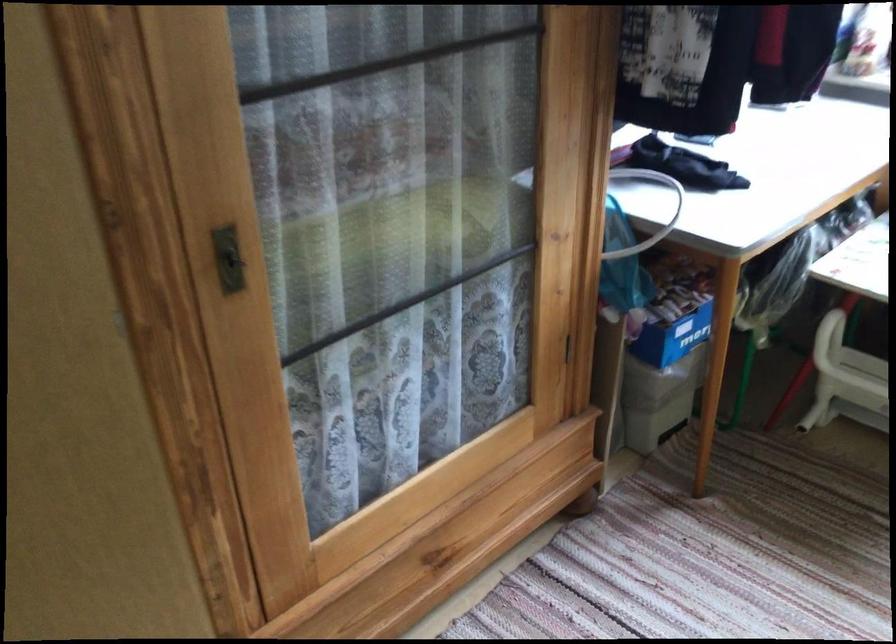
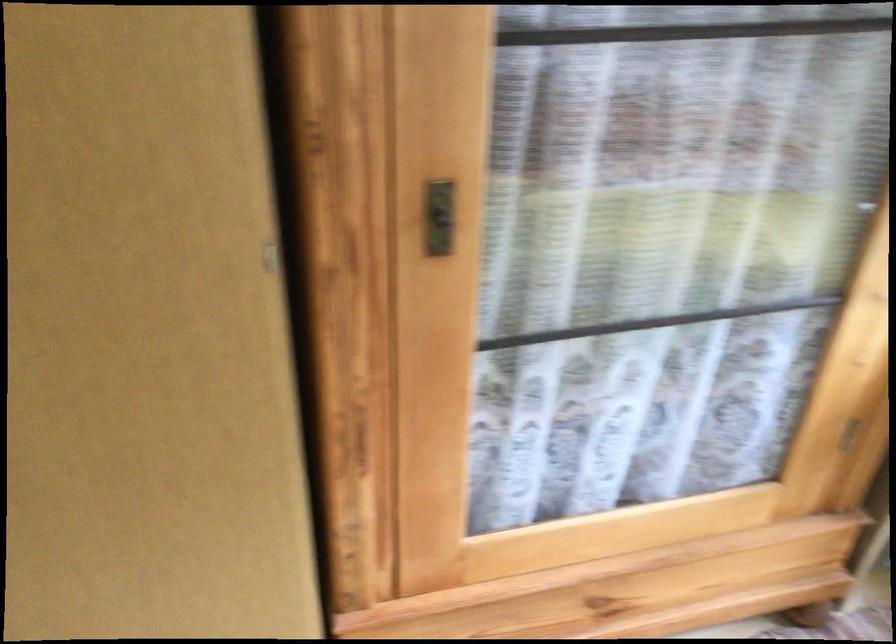
Question: The camera is either moving clockwise (left) or counter-clockwise (right) around the object. The first image is from the beginning of the video and the second image is from the end. Is the camera moving left or right when shooting the video?

Choices:
 (A) Left
 (B) Right

Answer: (B)